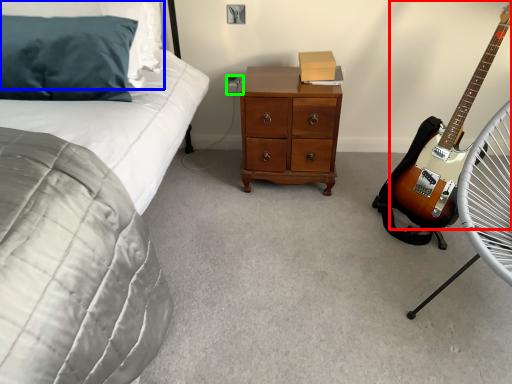
Question: Estimate the real-world distances between objects in this image. Which object is farther from guitar (highlighted by a red box), pillow (highlighted by a blue box) or electric outlet (highlighted by a green box)?

Choices:
 (A) pillow
 (B) electric outlet

Answer: (A)